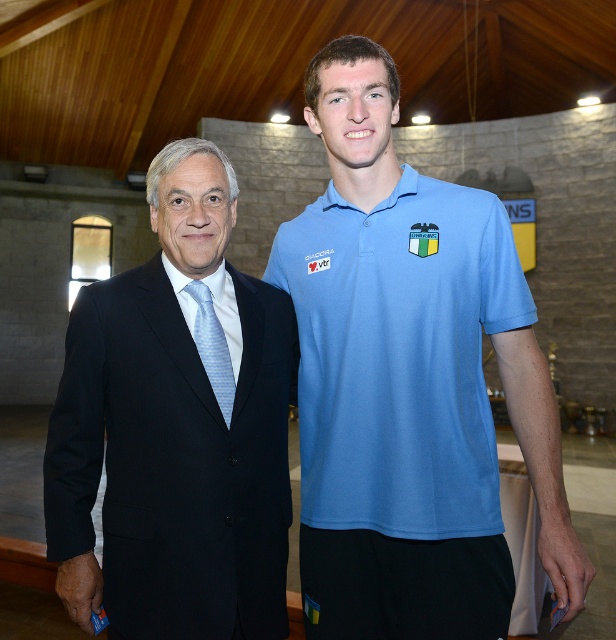
Question: Among these objects, which one is farthest from the camera?

Choices:
 (A) light blue striped tie at left
 (B) blue cotton polo shirt at center

Answer: (A)

Question: From the image, what is the correct spatial relationship of blue cotton polo shirt at center in relation to light blue striped tie at left?

Choices:
 (A) left
 (B) right

Answer: (B)

Question: Can you confirm if black suit at left is positioned above light blue silk tie at left?

Choices:
 (A) no
 (B) yes

Answer: (A)

Question: Which object is farther from the camera taking this photo?

Choices:
 (A) blue cotton polo shirt at center
 (B) light blue silk tie at left
 (C) light blue striped tie at left
 (D) black suit at left

Answer: (B)

Question: Which of the following is the closest to the observer?

Choices:
 (A) black suit at left
 (B) light blue striped tie at left
 (C) blue cotton polo shirt at center
 (D) light blue silk tie at left

Answer: (A)

Question: Is blue cotton polo shirt at center positioned behind light blue silk tie at left?

Choices:
 (A) yes
 (B) no

Answer: (B)